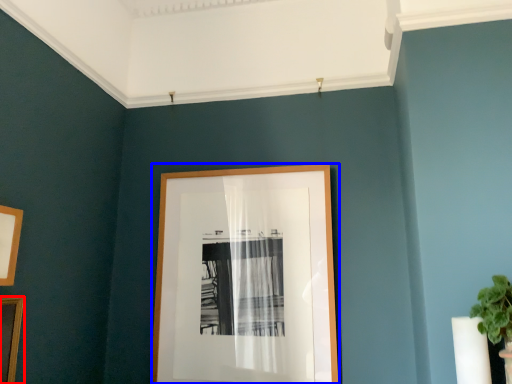
Question: Which of the following is the closest to the observer, picture frame (highlighted by a red box) or picture frame (highlighted by a blue box)?

Choices:
 (A) picture frame
 (B) picture frame

Answer: (A)